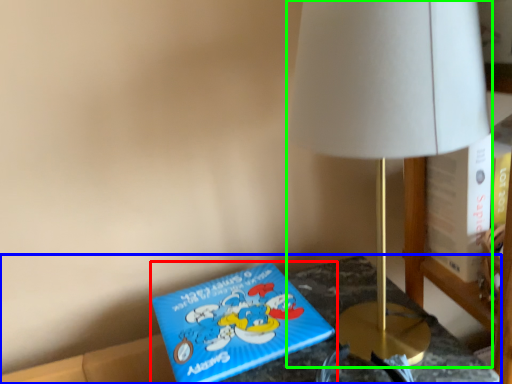
Question: Which object is positioned farthest from book (highlighted by a red box)? Select from furniture (highlighted by a blue box) and lamp (highlighted by a green box).

Choices:
 (A) furniture
 (B) lamp

Answer: (B)